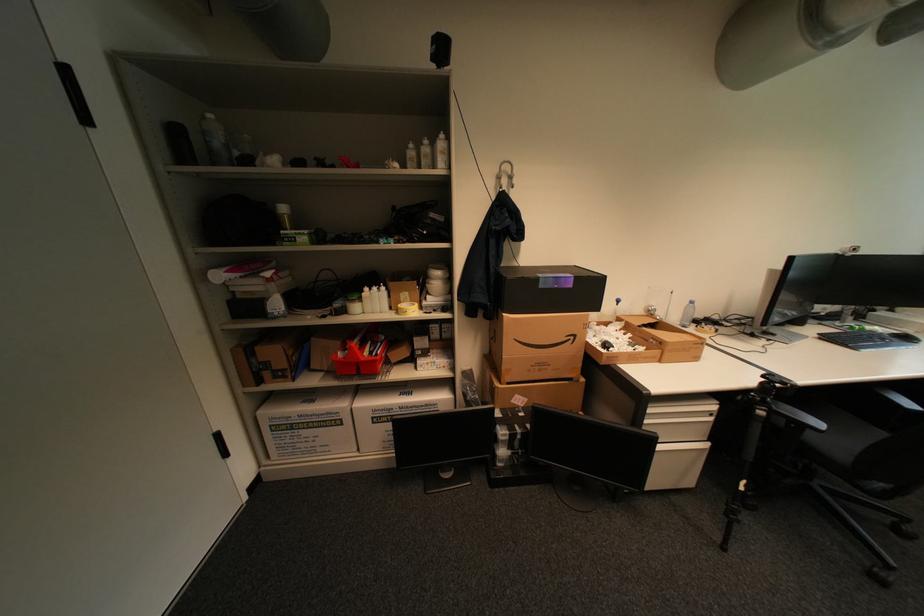
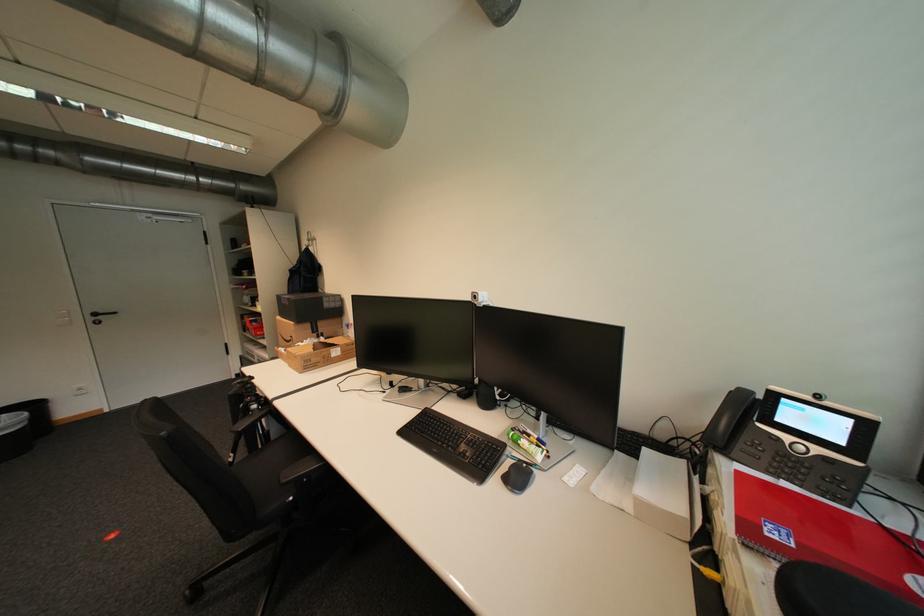
Where in the second image is the point corresponding to point 253,499 from the first image?

(242, 378)